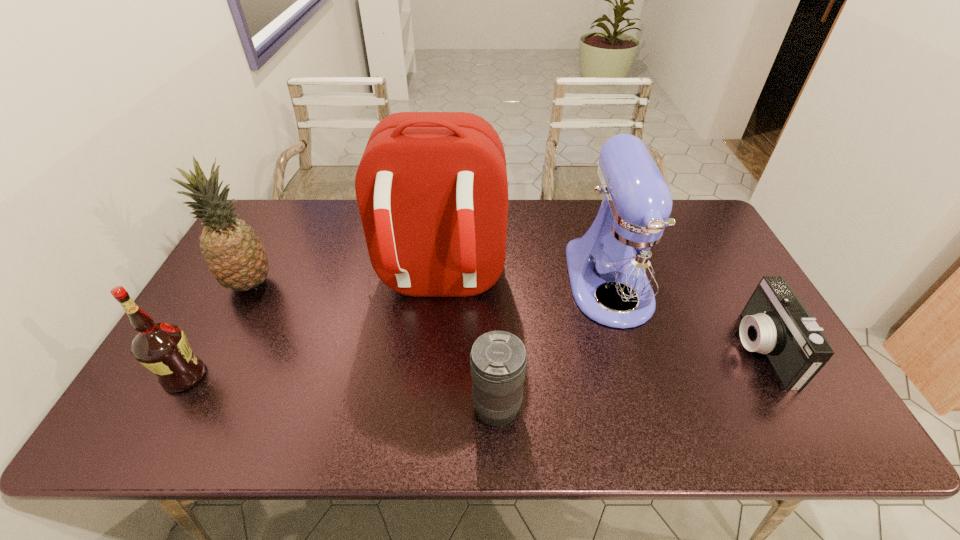
This screenshot has width=960, height=540. In order to click on backpack in this screenshot , I will do `click(431, 187)`.

Locate an element on the screen. pineapple is located at coordinates tap(235, 256).

Where is `the second object from right to left`? Image resolution: width=960 pixels, height=540 pixels. the second object from right to left is located at coordinates (627, 258).

The height and width of the screenshot is (540, 960). What are the coordinates of `alcohol` in the screenshot? It's located at (163, 348).

Where is `the second shortest object`? the second shortest object is located at coordinates (498, 360).

Find the location of a particular element. This screenshot has height=540, width=960. the shortest object is located at coordinates (776, 323).

Locate an element on the screen. Image resolution: width=960 pixels, height=540 pixels. camcorder is located at coordinates (776, 323).

Where is `free space located on the strap side of the tallest object`? The width and height of the screenshot is (960, 540). free space located on the strap side of the tallest object is located at coordinates (423, 444).

At what (x,y) coordinates should I click in order to perform the action: click on free spot located 0.100m on the right of the pineapple. Please return your answer as a coordinate pair (x, y). This screenshot has width=960, height=540. Looking at the image, I should click on (309, 284).

You are a GUI agent. You are given a task and a screenshot of the screen. Output one action in this format:
    pyautogui.click(x=<x>, y=<y>)
    Task: Click on the vacant space situated at the mixing area of the mixer
    Image resolution: width=960 pixels, height=540 pixels.
    Given the screenshot: What is the action you would take?
    pyautogui.click(x=644, y=400)